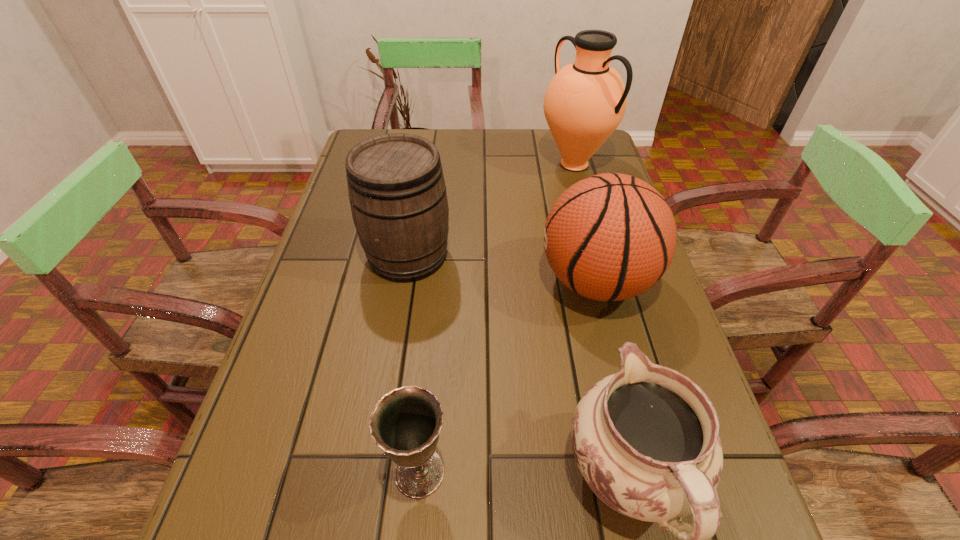
At what (x,y) coordinates should I click in order to perform the action: click on the farthest object. Please return your answer as a coordinate pair (x, y). The image size is (960, 540). Looking at the image, I should click on (584, 103).

Where is `the taller pitcher`? the taller pitcher is located at coordinates (584, 103).

This screenshot has width=960, height=540. I want to click on wine bucket, so click(396, 187).

Where is `basketball`? basketball is located at coordinates (609, 237).

Find the location of a particular element. The height and width of the screenshot is (540, 960). chalice is located at coordinates (405, 423).

This screenshot has height=540, width=960. In order to click on vacant point located 0.310m on the left of the farther pitcher in this screenshot , I will do `click(434, 164)`.

At what (x,y) coordinates should I click in order to perform the action: click on blank space located on the back of the wine bucket. Please return your answer as a coordinate pair (x, y). Looking at the image, I should click on (424, 157).

The height and width of the screenshot is (540, 960). I want to click on vacant point located 0.140m on the side where the inflation valve is located, so click(x=475, y=282).

At what (x,y) coordinates should I click in order to perform the action: click on free space located 0.200m on the side where the inflation valve is located. Please return your answer as a coordinate pair (x, y). The image size is (960, 540). Looking at the image, I should click on (448, 282).

Identify the location of vacant area located 0.150m on the side where the inflation valve is located. (471, 282).